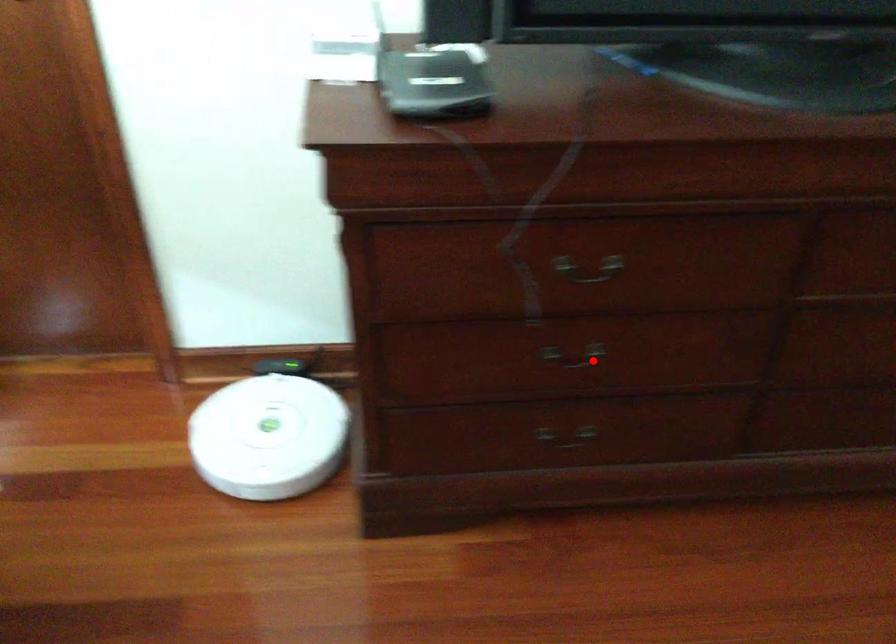
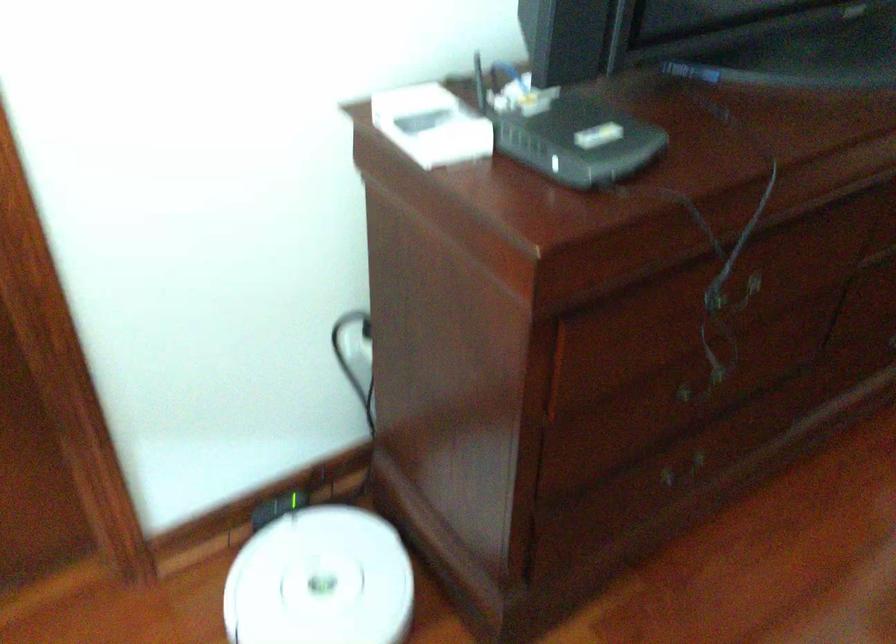
Find the pixel in the second image that matches the highlighted location in the first image.

(702, 384)